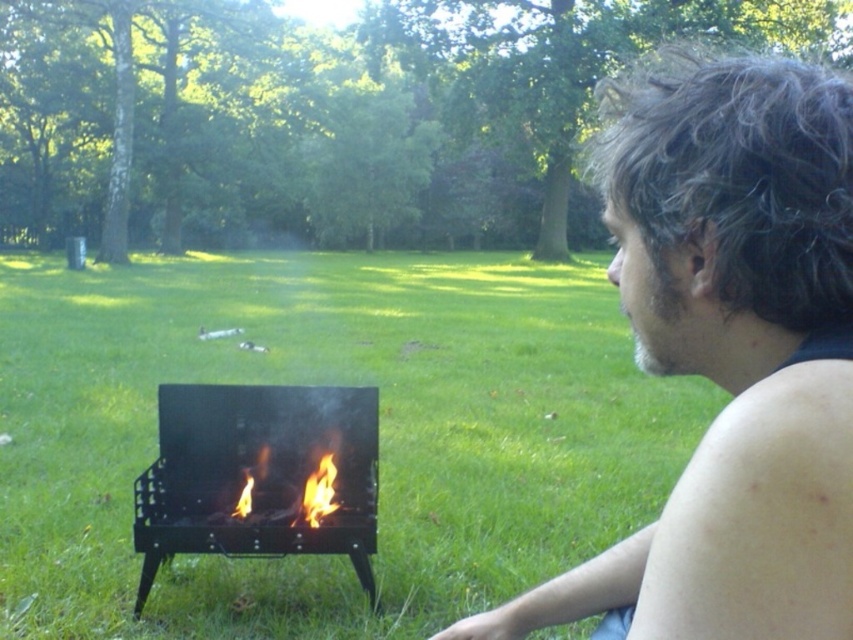
Which is in front, point (196, 285) or point (225, 509)?

Point (225, 509)

Does green grass at center appear on the right side of black matte barbecue grill at lower left?

Incorrect, green grass at center is not on the right side of black matte barbecue grill at lower left.

I want to click on green grass at center, so point(329,384).

Find the location of `green grass at center`. green grass at center is located at coordinates (329, 384).

Consider the image. Between green grass at center and flamematerial/texture at center, which one is positioned lower?

flamematerial/texture at center

Measure the distance from green grass at center to flamematerial/texture at center.

green grass at center is 20.01 feet away from flamematerial/texture at center.

Which is in front, point (701, 412) or point (309, 518)?

Point (309, 518) is in front.

What are the coordinates of `green grass at center` in the screenshot? It's located at (329, 384).

Is point (581, 502) closer to camera compared to point (695, 113)?

No, it is not.

Where is `green grass at center`? green grass at center is located at coordinates (329, 384).

This screenshot has width=853, height=640. I want to click on green grass at center, so click(329, 384).